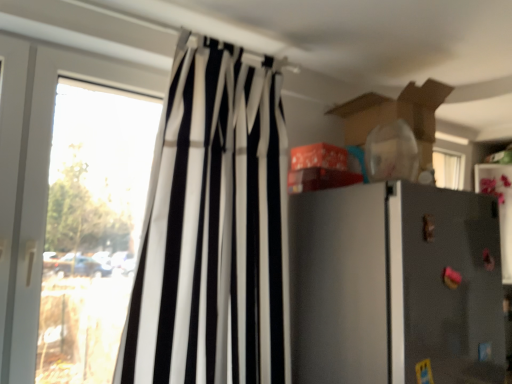
Question: Can you confirm if transparent glass window at left is bigger than metallic gray refrigerator at right?

Choices:
 (A) yes
 (B) no

Answer: (B)

Question: Does transparent glass window at left come in front of metallic gray refrigerator at right?

Choices:
 (A) no
 (B) yes

Answer: (A)

Question: Can you confirm if transparent glass window at left is positioned to the right of metallic gray refrigerator at right?

Choices:
 (A) no
 (B) yes

Answer: (A)

Question: Is transparent glass window at left positioned far away from metallic gray refrigerator at right?

Choices:
 (A) no
 (B) yes

Answer: (A)

Question: Can metallic gray refrigerator at right be found inside transparent glass window at left?

Choices:
 (A) yes
 (B) no

Answer: (B)

Question: From the image's perspective, does transparent glass window at left appear lower than metallic gray refrigerator at right?

Choices:
 (A) yes
 (B) no

Answer: (B)

Question: Is black/white striped curtain at left turned away from metallic gray refrigerator at right?

Choices:
 (A) yes
 (B) no

Answer: (B)

Question: Is black/white striped curtain at left closer to the viewer compared to metallic gray refrigerator at right?

Choices:
 (A) yes
 (B) no

Answer: (A)

Question: Is black/white striped curtain at left surrounding metallic gray refrigerator at right?

Choices:
 (A) no
 (B) yes

Answer: (A)

Question: From a real-world perspective, is black/white striped curtain at left on metallic gray refrigerator at right?

Choices:
 (A) yes
 (B) no

Answer: (A)

Question: From the image's perspective, is black/white striped curtain at left beneath metallic gray refrigerator at right?

Choices:
 (A) no
 (B) yes

Answer: (A)

Question: Does black/white striped curtain at left appear on the right side of metallic gray refrigerator at right?

Choices:
 (A) no
 (B) yes

Answer: (A)

Question: Is black/white striped curtain at left smaller than transparent glass window at left?

Choices:
 (A) yes
 (B) no

Answer: (B)